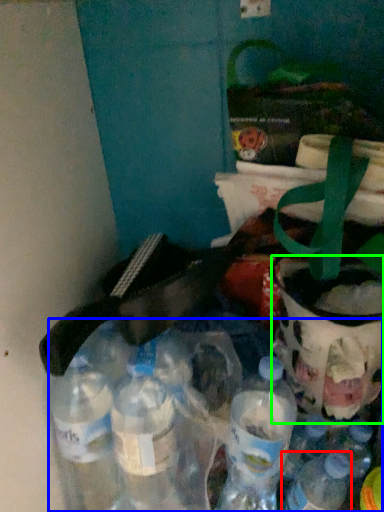
Question: Which object is the farthest from bottle (highlighted by a red box)? Choose among these: bottle (highlighted by a blue box) or glass jar (highlighted by a green box).

Choices:
 (A) bottle
 (B) glass jar

Answer: (A)